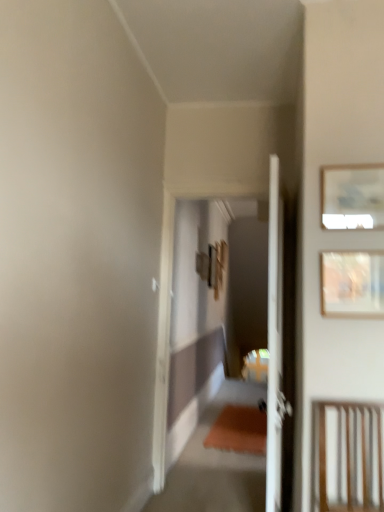
Question: From the image's perspective, is wooden framed artwork at upper right, which ranks as the second picture frame in top-to-bottom order, above or below matte white picture frame at upper right, which is the first picture frame in top-to-bottom order?

Choices:
 (A) above
 (B) below

Answer: (B)

Question: Considering their positions, is wooden framed artwork at upper right, which ranks as the second picture frame in top-to-bottom order, located in front of or behind matte white picture frame at upper right, which is the first picture frame in top-to-bottom order?

Choices:
 (A) front
 (B) behind

Answer: (A)

Question: Which of these objects is positioned closest to the matte white picture frame at upper right, which is the first picture frame in top-to-bottom order?

Choices:
 (A) wooden slats at lower right
 (B) wooden framed artwork at upper right, which ranks as the second picture frame in top-to-bottom order

Answer: (B)

Question: Considering the real-world distances, which object is farthest from the matte white picture frame at upper right, the second picture frame when ordered from bottom to top?

Choices:
 (A) wooden slats at lower right
 (B) wooden framed artwork at upper right, the 1th picture frame positioned from the bottom

Answer: (A)